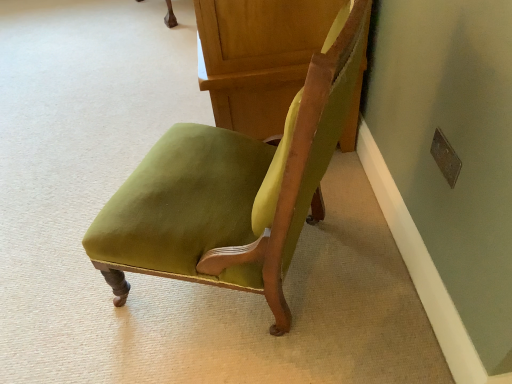
Where is `blank space to the left of velvet green chair at center`? Image resolution: width=512 pixels, height=384 pixels. blank space to the left of velvet green chair at center is located at coordinates (108, 86).